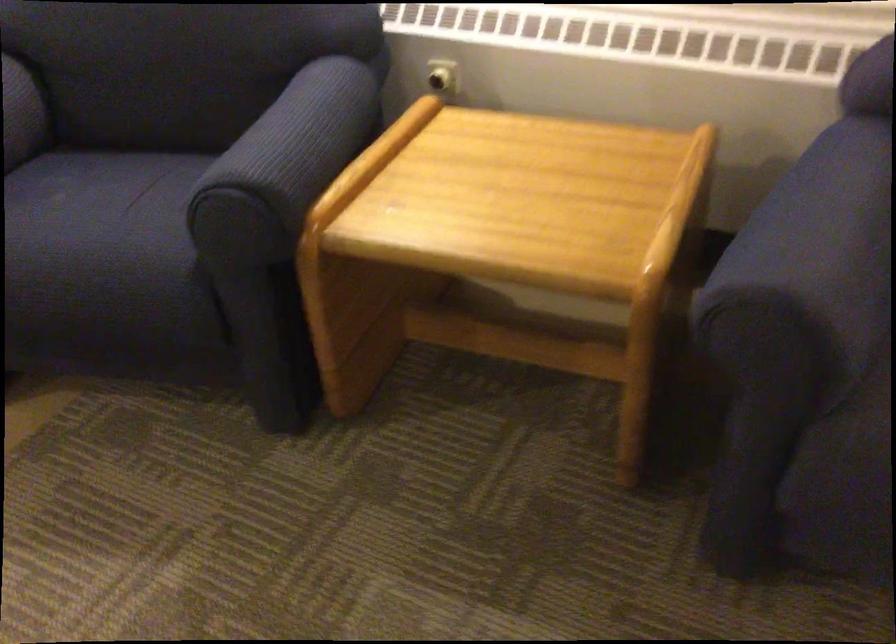
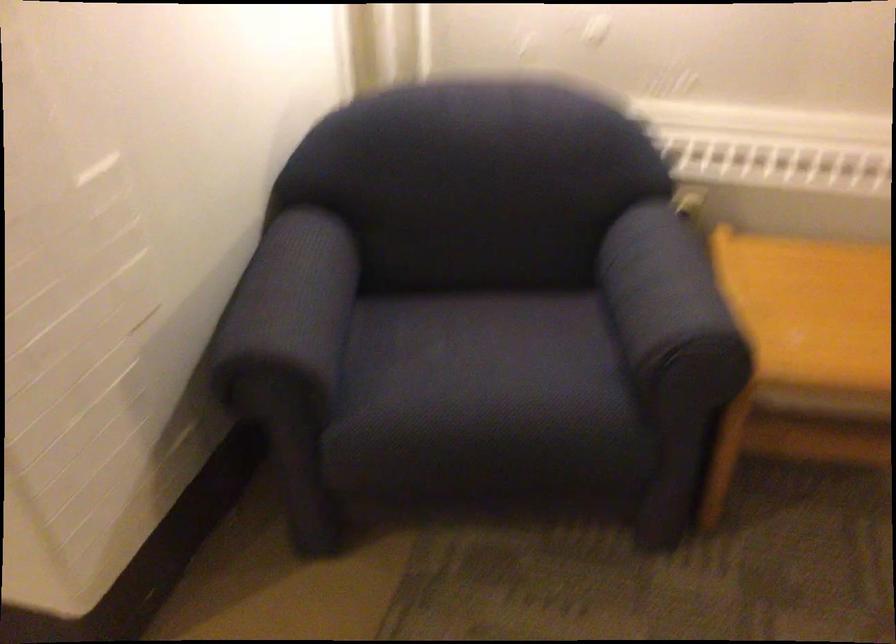
Where in the second image is the point corresponding to point 92,221 from the first image?

(485, 366)